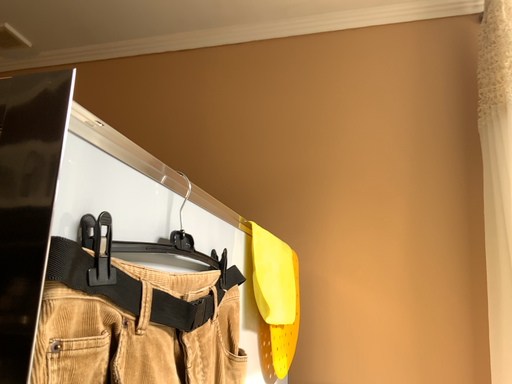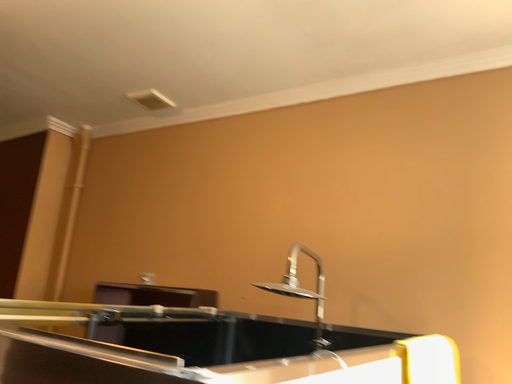
Question: Which way did the camera rotate in the video?

Choices:
 (A) rotated right
 (B) rotated left

Answer: (B)